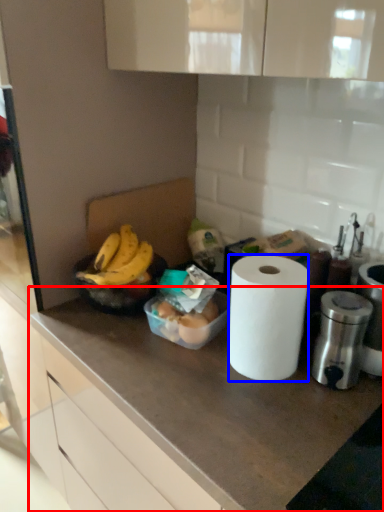
Question: Which of the following is the closest to the observer, countertop (highlighted by a red box) or paper towel (highlighted by a blue box)?

Choices:
 (A) countertop
 (B) paper towel

Answer: (A)